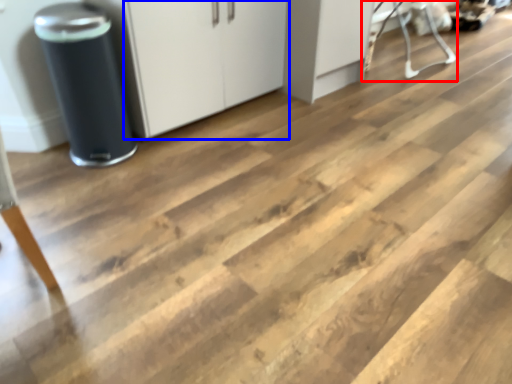
Question: Among these objects, which one is nearest to the camera, furniture (highlighted by a red box) or cabinetry (highlighted by a blue box)?

Choices:
 (A) furniture
 (B) cabinetry

Answer: (B)